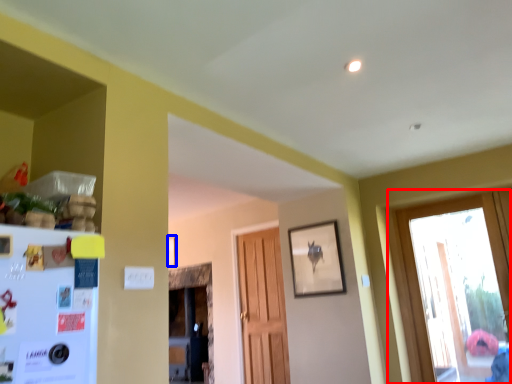
Question: Among these objects, which one is farthest to the camera, window (highlighted by a red box) or picture frame (highlighted by a blue box)?

Choices:
 (A) window
 (B) picture frame

Answer: (B)